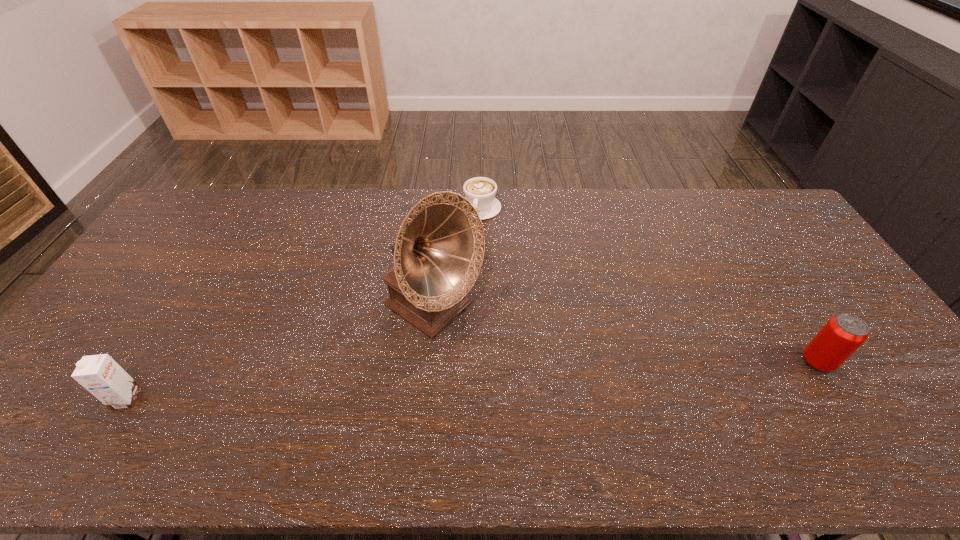
The width and height of the screenshot is (960, 540). In order to click on vacant space located 0.200m on the horn of the tallest object in this screenshot , I will do `click(533, 379)`.

This screenshot has height=540, width=960. What are the coordinates of `free space located 0.150m to the right of the farthest object's handle` in the screenshot? It's located at (468, 251).

At what (x,y) coordinates should I click in order to perform the action: click on free space located 0.100m to the right of the farthest object's handle. Please return your answer as a coordinate pair (x, y). This screenshot has width=960, height=540. Looking at the image, I should click on (470, 240).

Find the location of a particular element. vacant space located to the right of the farthest object's handle is located at coordinates (468, 252).

You are a GUI agent. You are given a task and a screenshot of the screen. Output one action in this format:
    pyautogui.click(x=<x>, y=<y>)
    Task: Click on the object located at the far edge
    The width and height of the screenshot is (960, 540).
    Given the screenshot: What is the action you would take?
    pyautogui.click(x=480, y=191)

Identify the location of object located at the near edge. pos(99,374).

Image resolution: width=960 pixels, height=540 pixels. In the image, there is a desktop. Find the location of `vacant space at the far edge`. vacant space at the far edge is located at coordinates (300, 200).

You are a GUI agent. You are given a task and a screenshot of the screen. Output one action in this format:
    pyautogui.click(x=<x>, y=<y>)
    Task: Click on the free space at the near edge of the desktop
    
    Given the screenshot: What is the action you would take?
    pyautogui.click(x=217, y=410)

The width and height of the screenshot is (960, 540). In order to click on free space at the left edge of the desktop in this screenshot , I will do tap(145, 289).

Locate an element on the screen. Image resolution: width=960 pixels, height=540 pixels. vacant area at the right edge of the desktop is located at coordinates (799, 233).